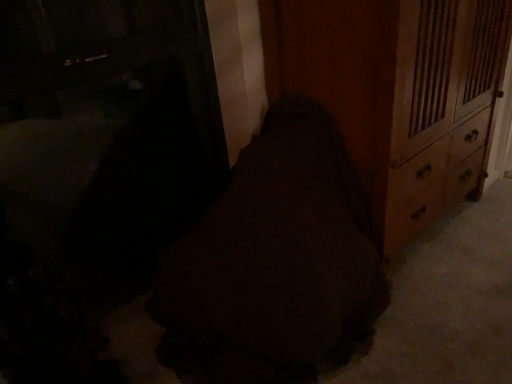
Describe the element at coordinates (396, 93) in the screenshot. Image resolution: width=512 pixels, height=384 pixels. I see `wooden chest of drawers at right` at that location.

The image size is (512, 384). In order to click on wooden chest of drawers at right in this screenshot , I will do `click(396, 93)`.

At what (x,y) coordinates should I click in order to perform the action: click on wooden chest of drawers at right. Please return your answer as a coordinate pair (x, y). This screenshot has height=384, width=512. Looking at the image, I should click on [396, 93].